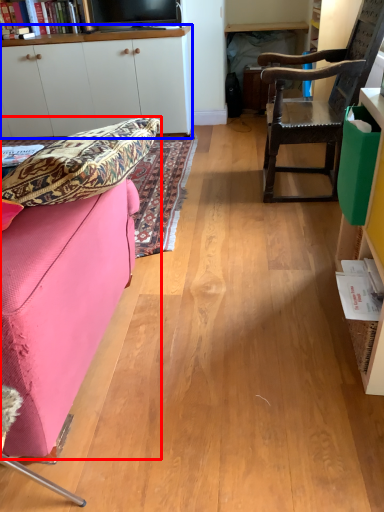
Question: Which point is further to the camera, studio couch (highlighted by a red box) or cabinetry (highlighted by a blue box)?

Choices:
 (A) studio couch
 (B) cabinetry

Answer: (B)